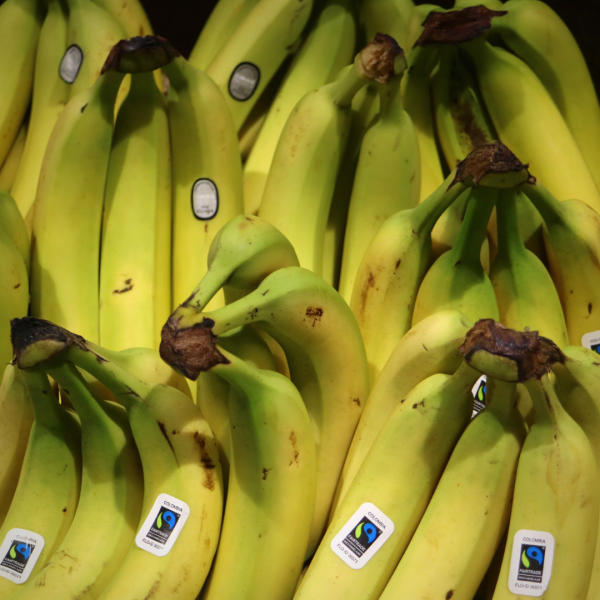
Image resolution: width=600 pixels, height=600 pixels. Identify the location of sticker. (15, 542), (175, 531), (364, 551), (520, 553), (594, 335), (208, 201), (246, 82), (68, 61).